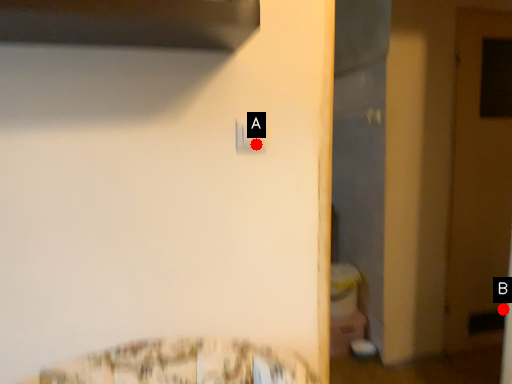
Question: Two points are circled on the image, labeled by A and B beside each circle. Which of the following is the farthest from the observer?

Choices:
 (A) A is further
 (B) B is further

Answer: (B)